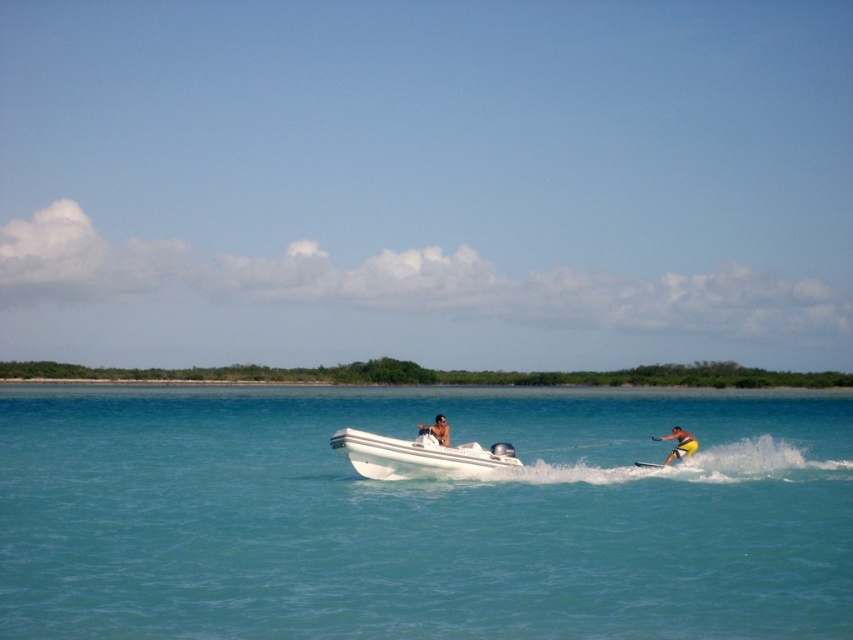
You are a photographer planning to capture the water skiing scene. The white smooth water at center is crucial for reflecting the skier. However, there is a point marked at coordinates (422, 515). Where is this point located in relation to the white smooth water at center?

The point marked at coordinates (422, 515) is located at the white smooth water at center.

You are a photographer trying to capture the water skiing action. You notice the white smooth water at center and the white matte boat at center in your viewfinder. Which object should you focus on if you want to highlight the area where the skier is currently gliding?

The white smooth water at center is located below the white matte boat at center, so focusing on the white smooth water at center would highlight the area where the skier is gliding since it is beneath the boat.

You are a photographer trying to capture the action of the water skier. You notice the white matte boat at center and the tan skin human at center in your viewfinder. Which object should you focus on first if you want to emphasize the boat pulling the human in the photo?

The white matte boat at center is in front of the tan skin human at center, so focusing on the boat first will help emphasize the boat pulling the human in the photo.